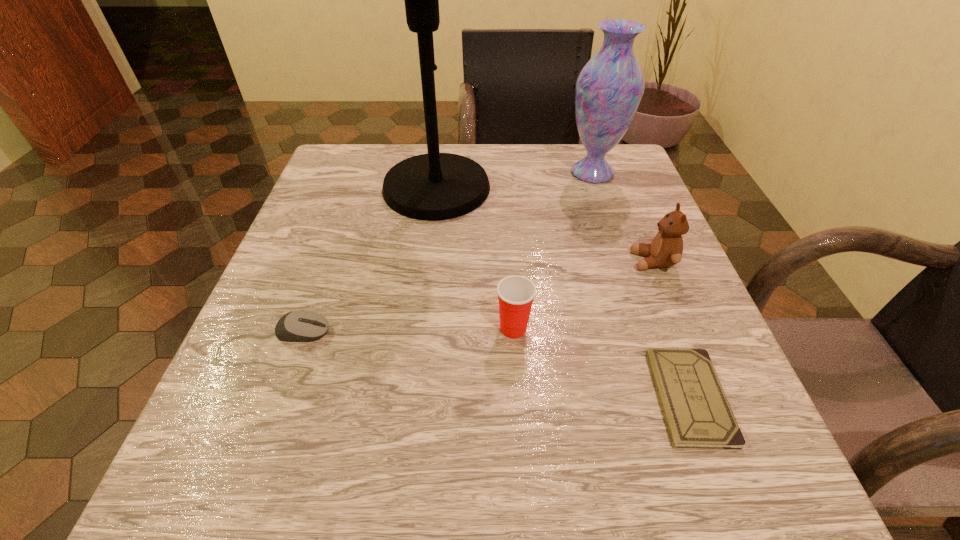
I want to click on the tallest object, so [x=435, y=186].

Identify the location of vase. 609,88.

I want to click on the fourth shortest object, so click(x=666, y=248).

In order to click on the fourth nearest object in this screenshot , I will do `click(666, 248)`.

I want to click on Dixie cup, so click(516, 293).

Where is `computer equipment`? computer equipment is located at coordinates (297, 326).

The width and height of the screenshot is (960, 540). Find the location of `the leftmost object`. the leftmost object is located at coordinates (297, 326).

Identify the location of checkbook. This screenshot has height=540, width=960. (697, 413).

This screenshot has height=540, width=960. I want to click on the shortest object, so click(697, 413).

Locate an element on the screen. This screenshot has width=960, height=540. free space located 0.170m on the right of the tallest object is located at coordinates (571, 188).